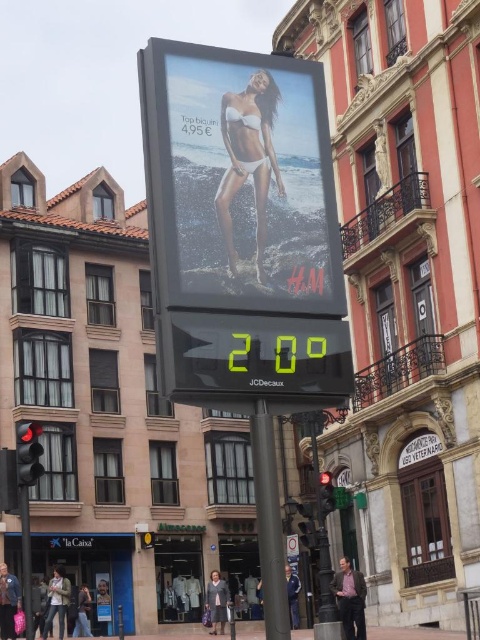
You are standing in front of the H M billboard on the street. There are two points marked on the billboard at coordinates point (x=243, y=160) and point (x=85, y=600). Which point is closer to you?

Point (x=243, y=160) is closer to the camera than point (x=85, y=600), so the point (x=243, y=160) is closer to you.

You are a delivery person who needs to deliver a package to the exact location of the point at coordinates (249, 160) in the image. What object at the center of the image should you aim for to ensure accurate delivery?

The point at coordinates (249, 160) corresponds to the white matte bikini at center, so you should aim for the white matte bikini at center to ensure accurate delivery.

You are a pedestrian crossing the street and see two red glass traffic lights. One is labeled as the red glass traffic light at left and the other as the red glass traffic light at center. Which one is positioned further to the left?

The red glass traffic light at left is positioned further to the left compared to the red glass traffic light at center.